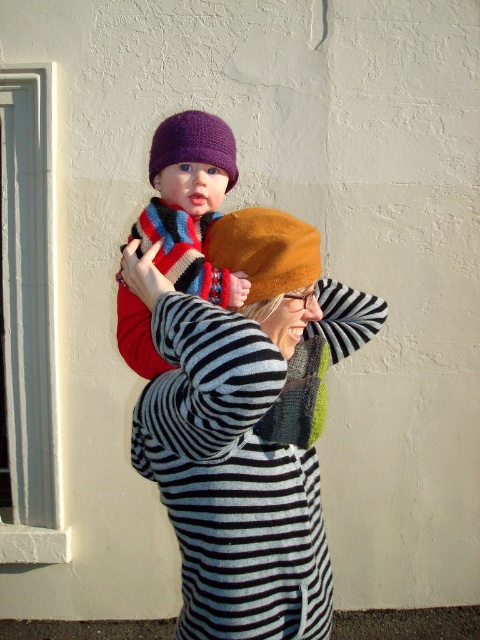
You are an architect designing a new building and want to place a decorative element at the point marked by coordinates point [190,204]. According to the image, what object is located at this point?

The point [190,204] is on the knitted woolen hat at upper center.